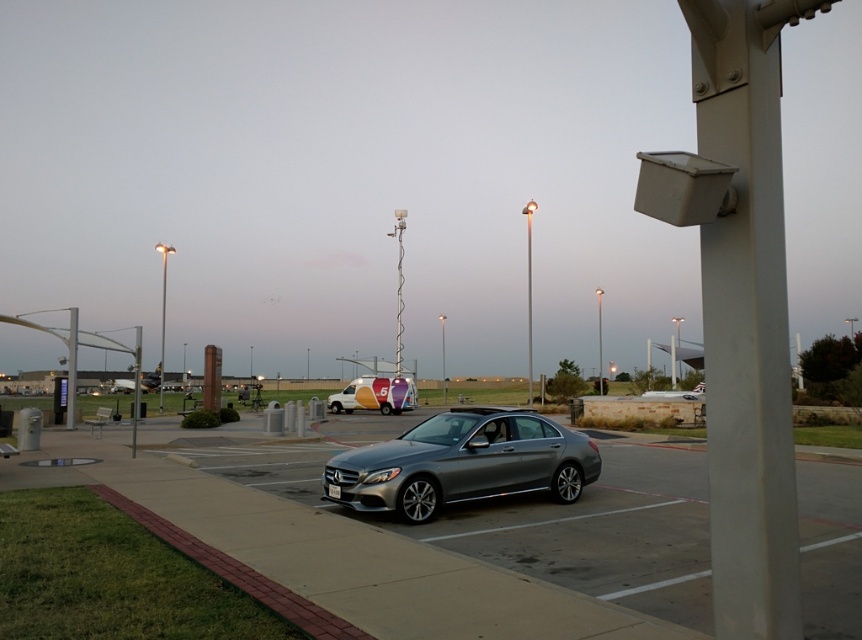
Question: Among these objects, which one is farthest from the camera?

Choices:
 (A) gray asphalt pavement at lower center
 (B) brushed metal pole at left
 (C) metallic silver van at center
 (D) brick at lower left

Answer: (C)

Question: Does brick at lower left have a larger size compared to brushed metal pole at left?

Choices:
 (A) yes
 (B) no

Answer: (B)

Question: Among these points, which one is farthest from the camera?

Choices:
 (A) (73, 397)
 (B) (389, 387)
 (C) (265, 448)
 (D) (341, 637)

Answer: (B)

Question: Which object appears farthest from the camera in this image?

Choices:
 (A) satin silver sedan at center
 (B) gray asphalt pavement at lower center

Answer: (A)

Question: Is gray asphalt pavement at lower center thinner than metallic silver van at center?

Choices:
 (A) yes
 (B) no

Answer: (B)

Question: Does satin silver sedan at center appear on the left side of brushed metal pole at left?

Choices:
 (A) no
 (B) yes

Answer: (A)